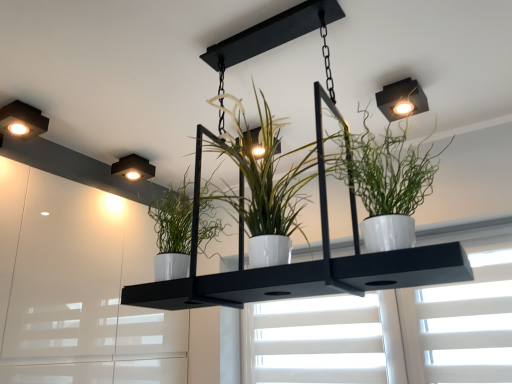
What do you see at coordinates (22, 120) in the screenshot?
I see `matte black square light at upper left, which is the first lamp from front to back` at bounding box center [22, 120].

This screenshot has width=512, height=384. What do you see at coordinates (387, 183) in the screenshot?
I see `white glossy pot at upper right, the 1th houseplant positioned from the right` at bounding box center [387, 183].

Where is `matte black square light fixture at upper left, which appears as the first lamp when viewed from the right`? This screenshot has width=512, height=384. matte black square light fixture at upper left, which appears as the first lamp when viewed from the right is located at coordinates (133, 168).

In order to click on white glossy cabinet at left in this screenshot , I will do `click(79, 287)`.

Where is `the 1st houseplant positioned below the matte black square light at upper right (from a real-world perspective)`? This screenshot has width=512, height=384. the 1st houseplant positioned below the matte black square light at upper right (from a real-world perspective) is located at coordinates (266, 177).

Is matte black square light at upper right wider or thinner than white glossy pot at center, arranged as the 2th houseplant when viewed from the right?

In the image, matte black square light at upper right appears to be more narrow than white glossy pot at center, arranged as the 2th houseplant when viewed from the right.

Which is behind, point (399, 83) or point (280, 212)?

The point (399, 83) is farther from the camera.

From a real-world perspective, which is physically below, matte black square light at upper right or white glossy pot at center, placed as the 1th houseplant when sorted from left to right?

white glossy pot at center, placed as the 1th houseplant when sorted from left to right.

Which is in front, white glossy pot at center, placed as the 1th houseplant when sorted from left to right, or matte black square light fixture at upper left, which appears as the first lamp when viewed from the right?

Positioned in front is white glossy pot at center, placed as the 1th houseplant when sorted from left to right.

Looking at this image, from a real-world perspective, is white glossy pot at center, arranged as the 2th houseplant when viewed from the right, over matte black square light fixture at upper left, acting as the 2th lamp starting from the top?

No.

Is white glossy pot at center, arranged as the 2th houseplant when viewed from the right, not close to matte black square light fixture at upper left, which appears as the 2th lamp when viewed from the front?

white glossy pot at center, arranged as the 2th houseplant when viewed from the right, is actually quite close to matte black square light fixture at upper left, which appears as the 2th lamp when viewed from the front.

From their relative heights in the image, would you say white glossy pot at center, placed as the 1th houseplant when sorted from left to right, is taller or shorter than matte black square light fixture at upper left, which is counted as the second lamp, starting from the left?

In the image, white glossy pot at center, placed as the 1th houseplant when sorted from left to right, appears to be taller than matte black square light fixture at upper left, which is counted as the second lamp, starting from the left.

Which point is more forward, (59, 208) or (496, 287)?

Positioned in front is point (496, 287).

Consider the image. Could you tell me if white glossy cabinet at left is facing white matte window at center?

Yes, white glossy cabinet at left is aimed at white matte window at center.

From a real-world perspective, who is located lower, white glossy cabinet at left or white matte window at center?

In real-world perspective, white matte window at center is lower.

Is white glossy pot at center, arranged as the 2th houseplant when viewed from the right, positioned far away from white matte window at center?

No.

How many degrees apart are the facing directions of white glossy pot at center, arranged as the 2th houseplant when viewed from the right, and white matte window at center?

The angular difference between white glossy pot at center, arranged as the 2th houseplant when viewed from the right, and white matte window at center is 2.54 degrees.

Is white matte window at center completely or partially inside white glossy pot at center, arranged as the 2th houseplant when viewed from the right?

No.

Is white glossy pot at center, arranged as the 2th houseplant when viewed from the right, positioned with its back to white matte window at center?

Yes.

Find the location of a particular element. lamp beneath the matte black square light fixture at upper left, which appears as the 2th lamp when viewed from the front (from a real-world perspective) is located at coordinates (22, 120).

Which object is positioned more to the left, matte black square light at upper left, which appears as the second lamp when viewed from the back, or matte black square light fixture at upper left, acting as the 2th lamp starting from the top?

matte black square light at upper left, which appears as the second lamp when viewed from the back, is more to the left.

Can you see matte black square light at upper left, which is counted as the 1th lamp, starting from the top, touching matte black square light fixture at upper left, the 1th lamp from the bottom?

matte black square light at upper left, which is counted as the 1th lamp, starting from the top, and matte black square light fixture at upper left, the 1th lamp from the bottom, are not in contact.

Is point (442, 306) positioned before point (22, 114)?

No, it is not.

Which is more to the right, white matte window at center or matte black square light at upper left, which is the first lamp from front to back?

Positioned to the right is white matte window at center.

Is white matte window at center positioned far away from matte black square light at upper left, which is counted as the 1th lamp, starting from the top?

white matte window at center is far away from matte black square light at upper left, which is counted as the 1th lamp, starting from the top.

From the image's perspective, is matte black square light fixture at upper left, which appears as the first lamp when viewed from the back, located above or below white glossy pot at upper right, the 1th houseplant positioned from the right?

Based on their image positions, matte black square light fixture at upper left, which appears as the first lamp when viewed from the back, is located above white glossy pot at upper right, the 1th houseplant positioned from the right.

Which is in front, point (112, 172) or point (435, 161)?

The point (435, 161) is in front.

Is matte black square light fixture at upper left, which is counted as the second lamp, starting from the left, facing away from white glossy pot at upper right, which ranks as the second houseplant in left-to-right order?

No, white glossy pot at upper right, which ranks as the second houseplant in left-to-right order, is not at the back of matte black square light fixture at upper left, which is counted as the second lamp, starting from the left.

Where is `houseplant that is the 2nd object to the left of the matte black square light at upper right, starting at the anchor`? Image resolution: width=512 pixels, height=384 pixels. houseplant that is the 2nd object to the left of the matte black square light at upper right, starting at the anchor is located at coordinates (266, 177).

Where is `the 2nd lamp located above the white glossy pot at center, placed as the 1th houseplant when sorted from left to right (from a real-world perspective)`? The height and width of the screenshot is (384, 512). the 2nd lamp located above the white glossy pot at center, placed as the 1th houseplant when sorted from left to right (from a real-world perspective) is located at coordinates (133, 168).

Based on their spatial positions, is white glossy cabinet at left or white matte window at center further from matte black square light at upper left, which appears as the second lamp when viewed from the back?

The object further to matte black square light at upper left, which appears as the second lamp when viewed from the back, is white matte window at center.

When comparing their distances from matte black square light fixture at upper left, the 1th lamp from the bottom, does white glossy cabinet at left or white matte window at center seem further?

Among the two, white matte window at center is located further to matte black square light fixture at upper left, the 1th lamp from the bottom.

Considering their positions, is white glossy pot at upper right, the 1th houseplant positioned from the right, positioned closer to white glossy pot at center, placed as the 1th houseplant when sorted from left to right, than matte black square light at upper left, which is the first lamp from front to back?

Based on the image, white glossy pot at upper right, the 1th houseplant positioned from the right, appears to be nearer to white glossy pot at center, placed as the 1th houseplant when sorted from left to right.

Considering their positions, is white glossy pot at upper right, the 1th houseplant positioned from the right, positioned further to matte black square light at upper right than white glossy pot at center, placed as the 1th houseplant when sorted from left to right?

white glossy pot at center, placed as the 1th houseplant when sorted from left to right, is positioned further to the anchor matte black square light at upper right.

Looking at the image, which one is located closer to white matte window at center, white glossy pot at center, arranged as the 2th houseplant when viewed from the right, or matte black square light fixture at upper left, which is counted as the second lamp, starting from the left?

Based on the image, white glossy pot at center, arranged as the 2th houseplant when viewed from the right, appears to be nearer to white matte window at center.

Considering their positions, is white glossy cabinet at left positioned closer to white matte window at center than white glossy pot at center, arranged as the 2th houseplant when viewed from the right?

Answer: Among the two, white glossy pot at center, arranged as the 2th houseplant when viewed from the right, is located nearer to white matte window at center.

Looking at the image, which one is located closer to white glossy pot at upper right, the 1th houseplant positioned from the right, white glossy pot at center, placed as the 1th houseplant when sorted from left to right, or white glossy cabinet at left?

white glossy pot at center, placed as the 1th houseplant when sorted from left to right, is closer to white glossy pot at upper right, the 1th houseplant positioned from the right.

Based on their spatial positions, is matte black square light at upper left, acting as the 1th lamp starting from the left, or matte black square light at upper right closer to white glossy cabinet at left?

The object closer to white glossy cabinet at left is matte black square light at upper left, acting as the 1th lamp starting from the left.

Locate an element on the screen. The image size is (512, 384). window between matte black square light at upper left, acting as the 1th lamp starting from the left, and matte black square light at upper right, in the horizontal direction is located at coordinates (464, 313).

What are the coordinates of `window frame positioned between white glossy pot at center, arranged as the 2th houseplant when viewed from the right, and matte black square light fixture at upper left, which is counted as the second lamp, starting from the left, from near to far` in the screenshot? It's located at (79, 287).

At what (x,y) coordinates should I click in order to perform the action: click on lamp situated between white glossy cabinet at left and matte black square light at upper right from left to right. Please return your answer as a coordinate pair (x, y). The height and width of the screenshot is (384, 512). Looking at the image, I should click on (133, 168).

Locate an element on the screen. The width and height of the screenshot is (512, 384). window frame between white glossy pot at upper right, which ranks as the second houseplant in left-to-right order, and matte black square light fixture at upper left, which is counted as the second lamp, starting from the left, along the z-axis is located at coordinates (79, 287).